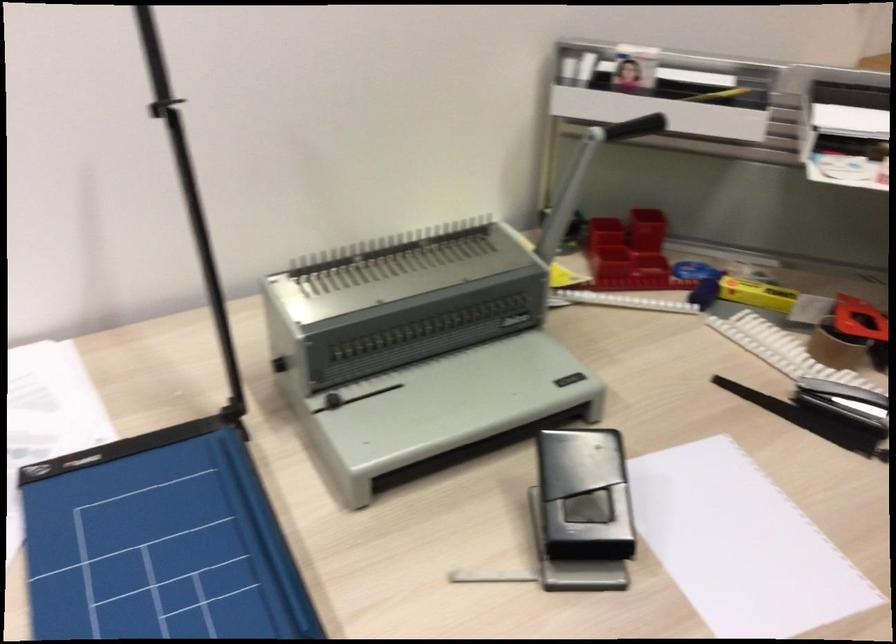
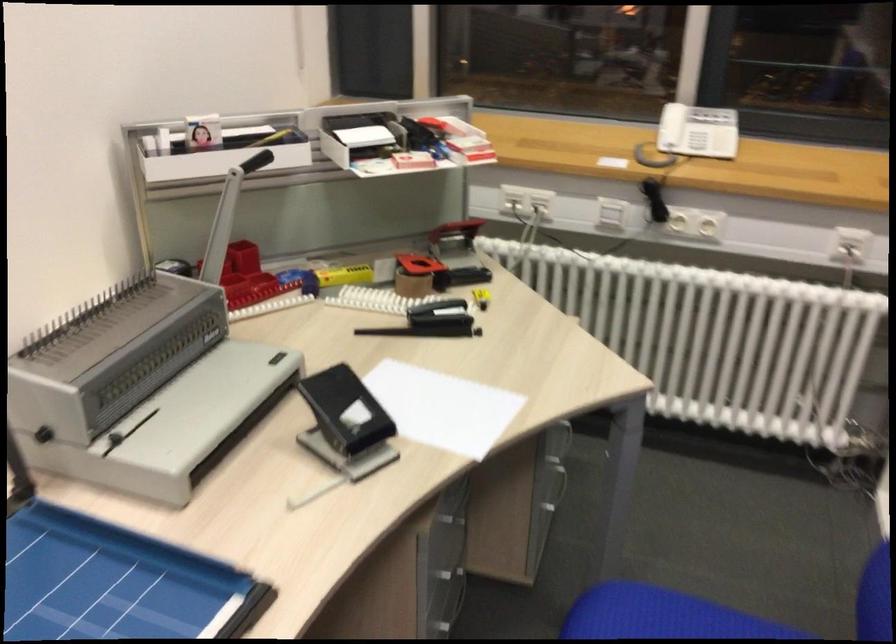
Locate, in the second image, the point that corresponds to pixel 789 129 in the first image.

(334, 149)